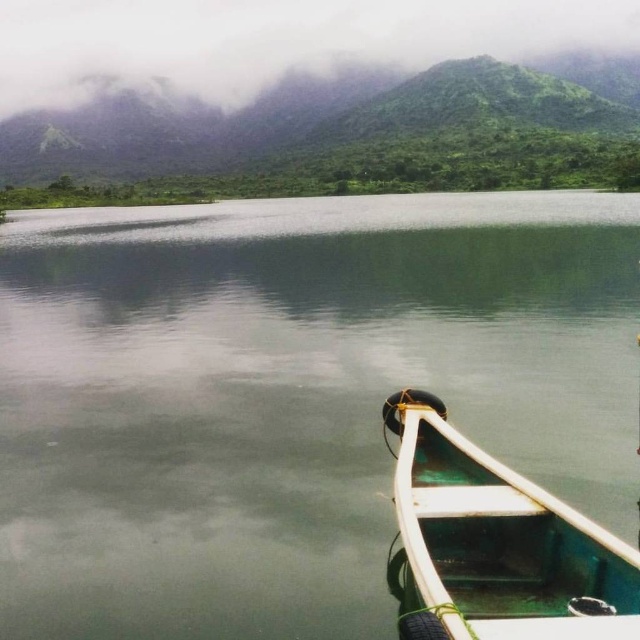
Can you confirm if green smooth water at center is taller than green matte boat at lower right?

Yes, green smooth water at center is taller than green matte boat at lower right.

Identify the location of green smooth water at center. The width and height of the screenshot is (640, 640). (289, 396).

Is point (36, 572) in front of point (413, 520)?

That is False.

You are a GUI agent. You are given a task and a screenshot of the screen. Output one action in this format:
    pyautogui.click(x=<x>, y=<y>)
    Task: Click on the green smooth water at center
    This screenshot has height=640, width=640.
    Given the screenshot: What is the action you would take?
    pyautogui.click(x=289, y=396)

Is point (579, 305) in front of point (20, 141)?

Yes, it is.

Does point (417, 321) come behind point (554, 140)?

No, it is not.

The width and height of the screenshot is (640, 640). I want to click on green smooth water at center, so pyautogui.click(x=289, y=396).

Does green textured mountain at upper center have a larger size compared to green matte boat at lower right?

Yes.

Can you confirm if green textured mountain at upper center is positioned to the right of green matte boat at lower right?

No, green textured mountain at upper center is not to the right of green matte boat at lower right.

Does point (616, 32) come farther from viewer compared to point (401, 524)?

Yes, point (616, 32) is farther from viewer.

Find the location of a particular element. Image resolution: width=640 pixels, height=640 pixels. green textured mountain at upper center is located at coordinates (276, 40).